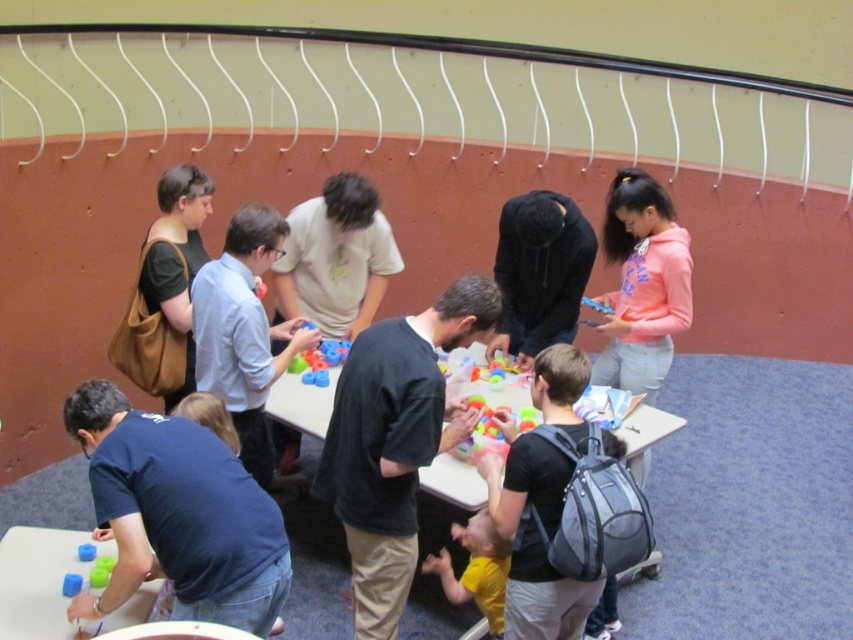
Does matte black backpack at center have a greater width compared to light blue shirt at center?

Indeed, matte black backpack at center has a greater width compared to light blue shirt at center.

Does point (506, 499) lie in front of point (231, 264)?

Yes, it is in front of point (231, 264).

Does point (550, 353) come in front of point (206, 337)?

Yes.

At what (x,y) coordinates should I click in order to perform the action: click on matte black backpack at center. Please return your answer as a coordinate pair (x, y). Image resolution: width=853 pixels, height=640 pixels. Looking at the image, I should click on (537, 540).

Does black matte hoodie at center appear on the left side of yellow matte shirt at lower center?

In fact, black matte hoodie at center is to the right of yellow matte shirt at lower center.

Can you confirm if black matte hoodie at center is positioned below yellow matte shirt at lower center?

Actually, black matte hoodie at center is above yellow matte shirt at lower center.

Is point (527, 291) more distant than point (491, 557)?

Yes, it is.

Locate an element on the screen. black matte hoodie at center is located at coordinates click(540, 272).

Is point (583, 253) farther from viewer compared to point (456, 371)?

Yes, point (583, 253) is behind point (456, 371).

Describe the element at coordinates (540, 272) in the screenshot. I see `black matte hoodie at center` at that location.

Does point (529, 364) come in front of point (270, 404)?

No.

Locate an element on the screen. Image resolution: width=853 pixels, height=640 pixels. black matte hoodie at center is located at coordinates click(x=540, y=272).